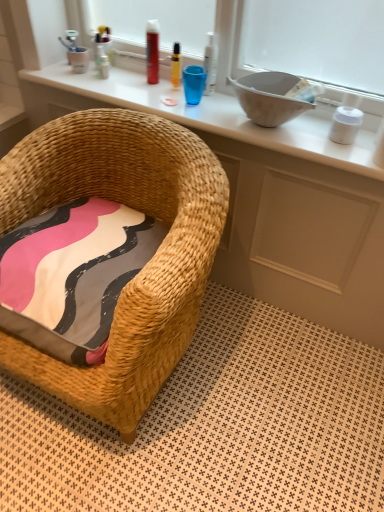
Identify the location of free location above pink fabric pillow at lower left (from a real-world perspective). (91, 240).